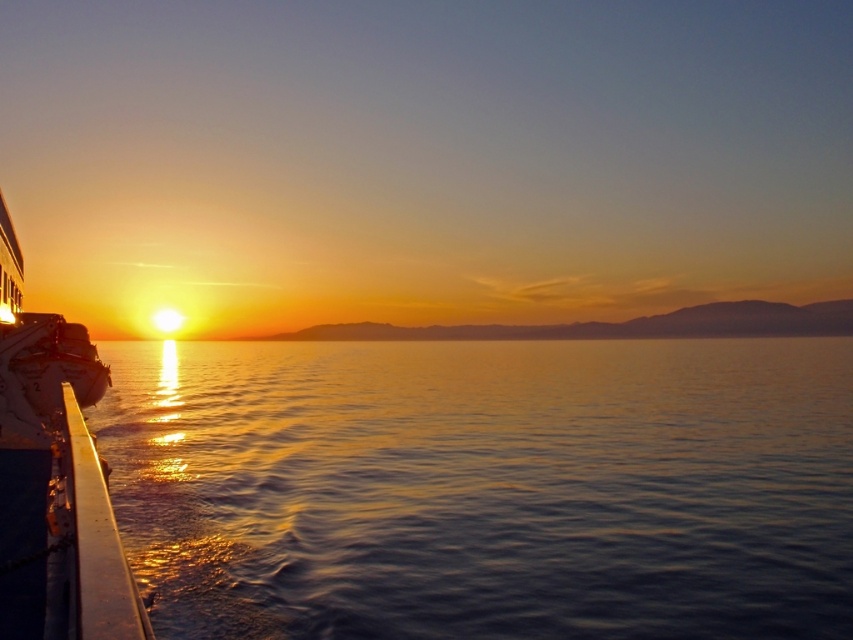
Question: Is glistening water at left smaller than shiny silver boat at left?

Choices:
 (A) yes
 (B) no

Answer: (B)

Question: Can you confirm if glistening water at left is bigger than shiny silver boat at left?

Choices:
 (A) no
 (B) yes

Answer: (B)

Question: Which point is farther to the camera?

Choices:
 (A) (9, 376)
 (B) (204, 595)

Answer: (A)

Question: Where is glistening water at left located in relation to shiny silver boat at left in the image?

Choices:
 (A) left
 (B) right

Answer: (A)

Question: Which object is farther from the camera taking this photo?

Choices:
 (A) shiny silver boat at left
 (B) glistening water at left

Answer: (B)